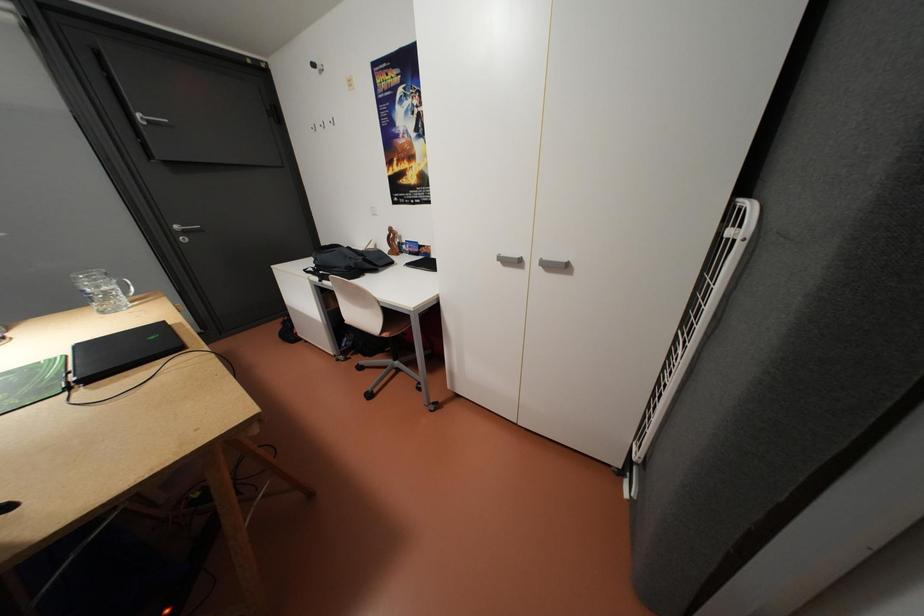
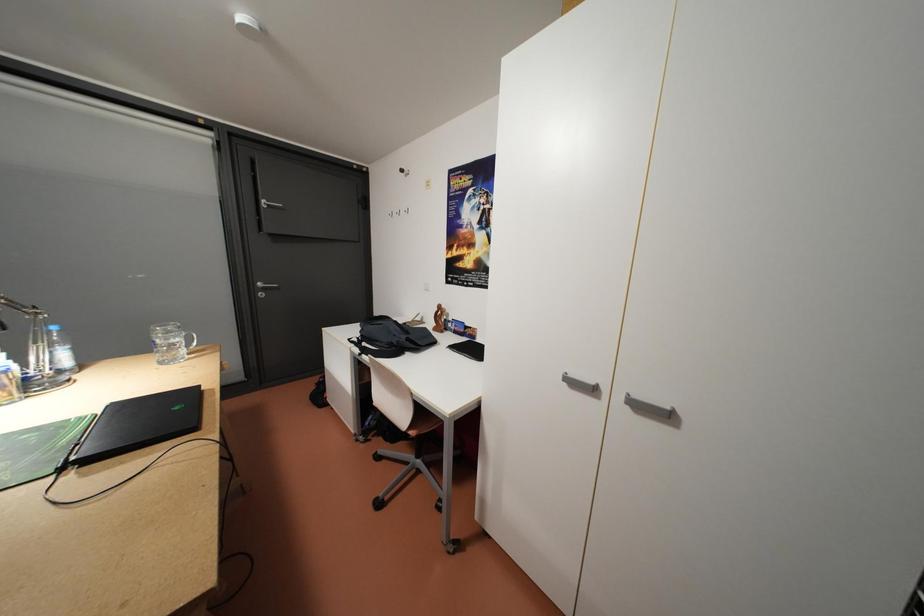
Question: The first image is from the beginning of the video and the second image is from the end. How did the camera likely rotate when shooting the video?

Choices:
 (A) Left
 (B) Right
 (C) Up
 (D) Down

Answer: (C)